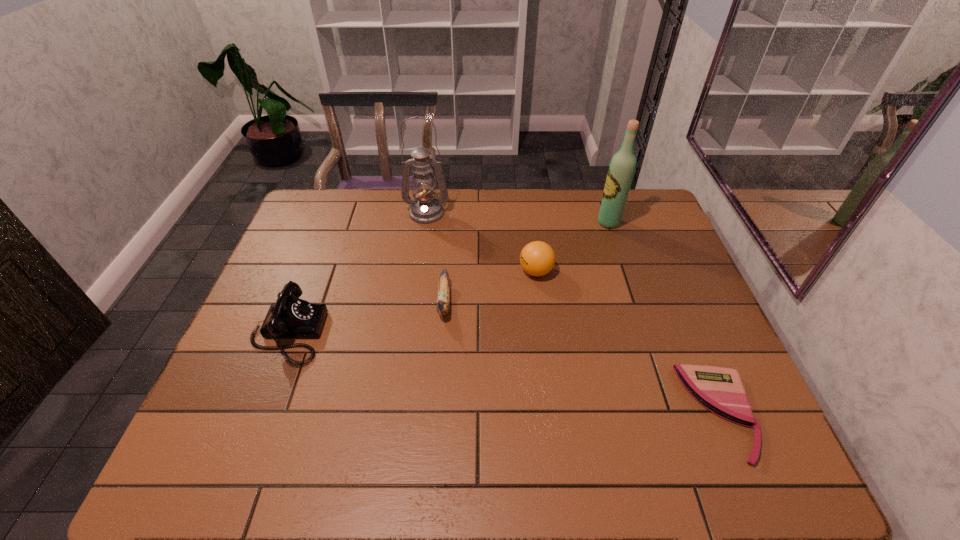
This screenshot has height=540, width=960. Find the location of `free space located 0.120m on the dial of the leftmost object`. free space located 0.120m on the dial of the leftmost object is located at coordinates (369, 333).

Where is `free space located 0.090m on the side with brand of the fourth object from left to right`? The image size is (960, 540). free space located 0.090m on the side with brand of the fourth object from left to right is located at coordinates (489, 272).

This screenshot has height=540, width=960. Identify the location of vacant region located 0.360m on the side with brand of the fourth object from left to right. (398, 272).

Locate an element on the screen. This screenshot has height=540, width=960. vacant space located on the side with brand of the fourth object from left to right is located at coordinates (475, 272).

What are the coordinates of `free region located 0.110m at the stem of the banana` in the screenshot? It's located at (440, 360).

The height and width of the screenshot is (540, 960). I want to click on vacant space located on the back of the shortest object, so click(675, 303).

You are a GUI agent. You are given a task and a screenshot of the screen. Output one action in this format:
    pyautogui.click(x=<x>, y=<y>)
    Task: Click on the wine bottle at the far edge
    
    Given the screenshot: What is the action you would take?
    pyautogui.click(x=621, y=170)

Where is `oil lamp that is at the far edge`? This screenshot has width=960, height=540. oil lamp that is at the far edge is located at coordinates (425, 208).

This screenshot has width=960, height=540. Find the location of `object that is positioned at the near edge`. object that is positioned at the near edge is located at coordinates (720, 390).

Where is `object positioned at the left edge`? The height and width of the screenshot is (540, 960). object positioned at the left edge is located at coordinates (290, 317).